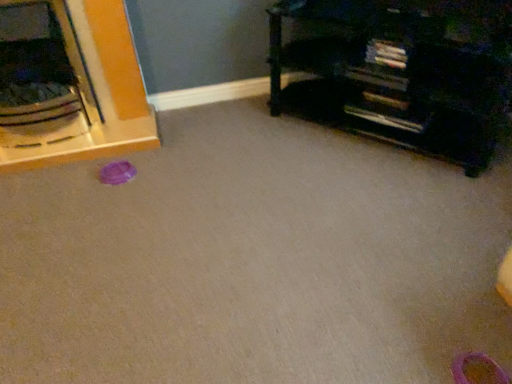
Question: Considering the relative sizes of brushed metal bowl at left, which appears as the first furniture when viewed from the left, and pink rubber shoe at lower right in the image provided, is brushed metal bowl at left, which appears as the first furniture when viewed from the left, thinner than pink rubber shoe at lower right?

Choices:
 (A) yes
 (B) no

Answer: (B)

Question: From the image's perspective, is brushed metal bowl at left, the second furniture viewed from the right, over pink rubber shoe at lower right?

Choices:
 (A) no
 (B) yes

Answer: (B)

Question: Is brushed metal bowl at left, which appears as the first furniture when viewed from the left, facing away from pink rubber shoe at lower right?

Choices:
 (A) yes
 (B) no

Answer: (B)

Question: Does brushed metal bowl at left, the second furniture viewed from the right, come behind pink rubber shoe at lower right?

Choices:
 (A) no
 (B) yes

Answer: (B)

Question: Does brushed metal bowl at left, which appears as the first furniture when viewed from the left, contain pink rubber shoe at lower right?

Choices:
 (A) no
 (B) yes

Answer: (A)

Question: From a real-world perspective, does brushed metal bowl at left, which appears as the first furniture when viewed from the left, sit lower than pink rubber shoe at lower right?

Choices:
 (A) no
 (B) yes

Answer: (A)

Question: Considering the relative sizes of pink rubber shoe at lower right and black matte bookshelf at upper right, the 2th furniture when ordered from left to right, in the image provided, is pink rubber shoe at lower right taller than black matte bookshelf at upper right, the 2th furniture when ordered from left to right,?

Choices:
 (A) yes
 (B) no

Answer: (B)

Question: Is the position of pink rubber shoe at lower right less distant than that of black matte bookshelf at upper right, the 1th furniture positioned from the right?

Choices:
 (A) no
 (B) yes

Answer: (B)

Question: Considering the relative sizes of pink rubber shoe at lower right and black matte bookshelf at upper right, the 1th furniture positioned from the right, in the image provided, is pink rubber shoe at lower right thinner than black matte bookshelf at upper right, the 1th furniture positioned from the right,?

Choices:
 (A) no
 (B) yes

Answer: (B)

Question: Would you say pink rubber shoe at lower right is outside black matte bookshelf at upper right, the 2th furniture when ordered from left to right?

Choices:
 (A) no
 (B) yes

Answer: (B)

Question: Does pink rubber shoe at lower right have a larger size compared to black matte bookshelf at upper right, the 1th furniture positioned from the right?

Choices:
 (A) no
 (B) yes

Answer: (A)

Question: From the image's perspective, is pink rubber shoe at lower right above black matte bookshelf at upper right, the 2th furniture when ordered from left to right?

Choices:
 (A) no
 (B) yes

Answer: (A)

Question: Is black matte bookshelf at upper right, the 2th furniture when ordered from left to right, taller than brushed metal bowl at left, the second furniture viewed from the right?

Choices:
 (A) yes
 (B) no

Answer: (B)